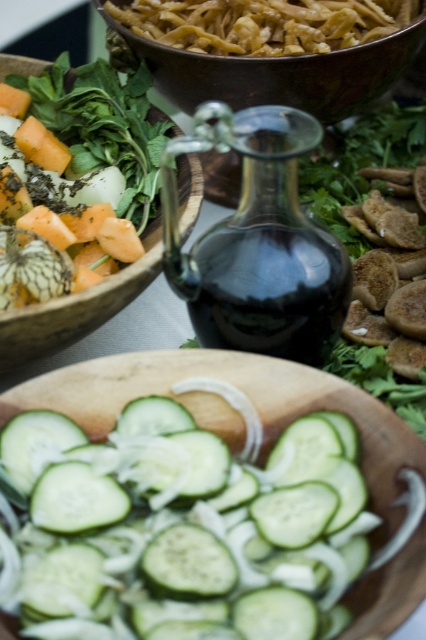
Question: Does green smooth cucumber at center have a greater width compared to wooden bowl at upper left?

Choices:
 (A) no
 (B) yes

Answer: (A)

Question: Which point is farther to the camera?

Choices:
 (A) golden pasta at upper center
 (B) green smooth cucumber at center

Answer: (A)

Question: Considering the relative positions of matte brown bowl at upper center and golden pasta at upper center in the image provided, where is matte brown bowl at upper center located with respect to golden pasta at upper center?

Choices:
 (A) above
 (B) below

Answer: (B)

Question: Which point is farther to the camera?

Choices:
 (A) matte brown bowl at upper center
 (B) green smooth cucumber at center
 (C) wooden bowl at upper left
 (D) golden pasta at upper center

Answer: (D)

Question: Which point is closer to the camera?

Choices:
 (A) (236, 4)
 (B) (127, 285)

Answer: (B)

Question: Is green smooth cucumber at center wider than wooden bowl at upper left?

Choices:
 (A) yes
 (B) no

Answer: (B)